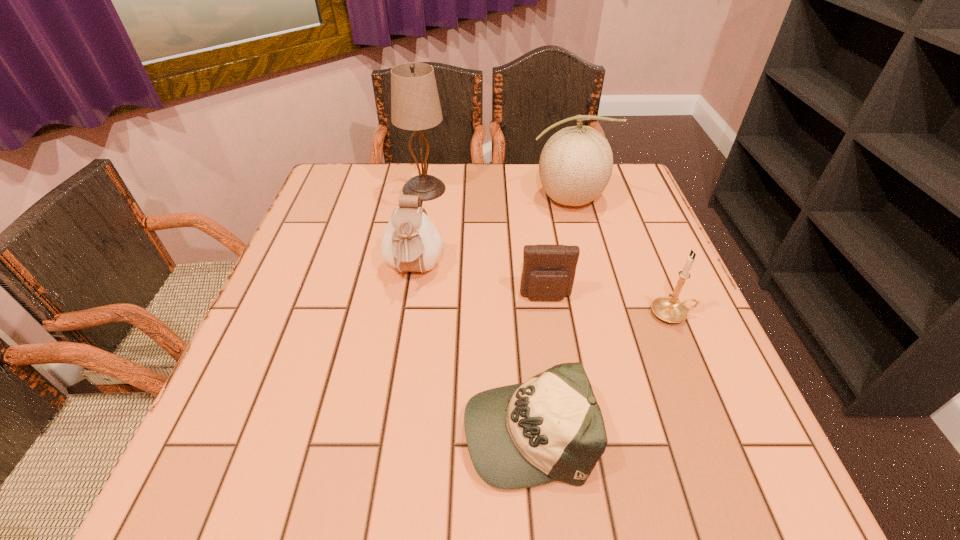
Find the location of `lampshade`. lampshade is located at coordinates (415, 105).

You are a GUI agent. You are given a task and a screenshot of the screen. Output one action in this format:
    pyautogui.click(x=<x>, y=<y>)
    Task: Click on the cantaloup
    The image size is (960, 540).
    Given the screenshot: What is the action you would take?
    pyautogui.click(x=576, y=163)

You are a GUI agent. You are given a task and a screenshot of the screen. Output one action in this format:
    pyautogui.click(x=<x>, y=<y>)
    Task: Click on the taller pouch
    Image resolution: width=960 pixels, height=540 pixels.
    Given the screenshot: What is the action you would take?
    pyautogui.click(x=410, y=242)

This screenshot has height=540, width=960. Identify the location of candle holder. (669, 309).

Locate an element on the screen. the shorter pouch is located at coordinates (548, 274).

Where is `the right pouch`? This screenshot has height=540, width=960. the right pouch is located at coordinates (548, 274).

Find the location of a particular element. the shortest object is located at coordinates (550, 428).

Where is `baseball cap`? This screenshot has height=540, width=960. baseball cap is located at coordinates (550, 428).

Find the location of a particular element. free space located 0.090m on the front-facing side of the lampshade is located at coordinates (479, 189).

I want to click on vacant space located on the left of the cantaloup, so click(478, 200).